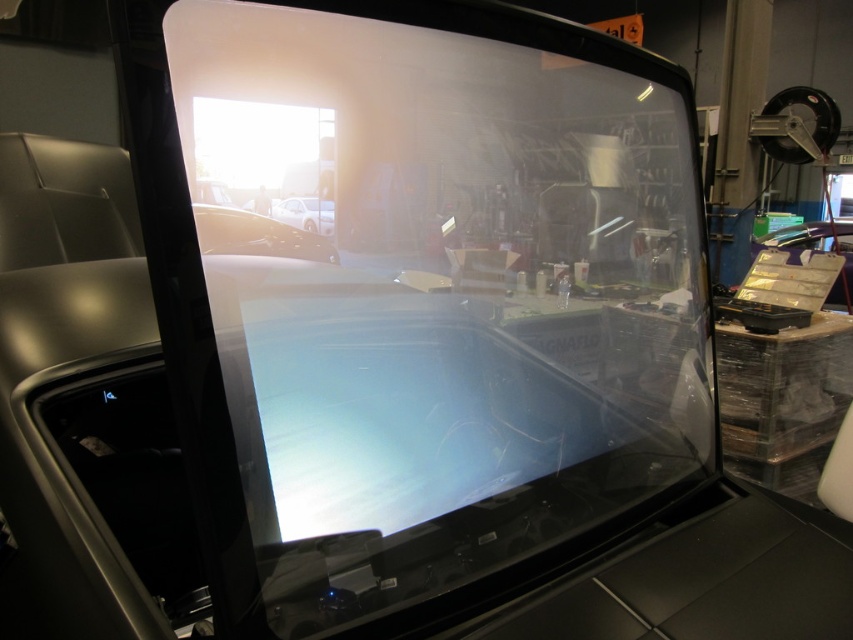
From the picture: You are a mechanic working in a garage. You need to park both the glossy white car at center and the matte black car at right into two parking spots that are exactly the same size. Based on the scene description, which car might have difficulty fitting into the parking spot and why?

The glossy white car at center has a lesser height compared to the matte black car at right. Since the parking spots are the same size, the matte black car at right might have difficulty fitting into the parking spot due to its greater height.

Looking at this image, you are a mechanic working in a garage. You need to move the matte black car at right and the white glossy car at center to make space for a new vehicle. Which car should you move first to avoid blocking the other?

You should move the matte black car at right first because it is positioned over the white glossy car at center, so moving it first will prevent blocking access to the white glossy car at center.